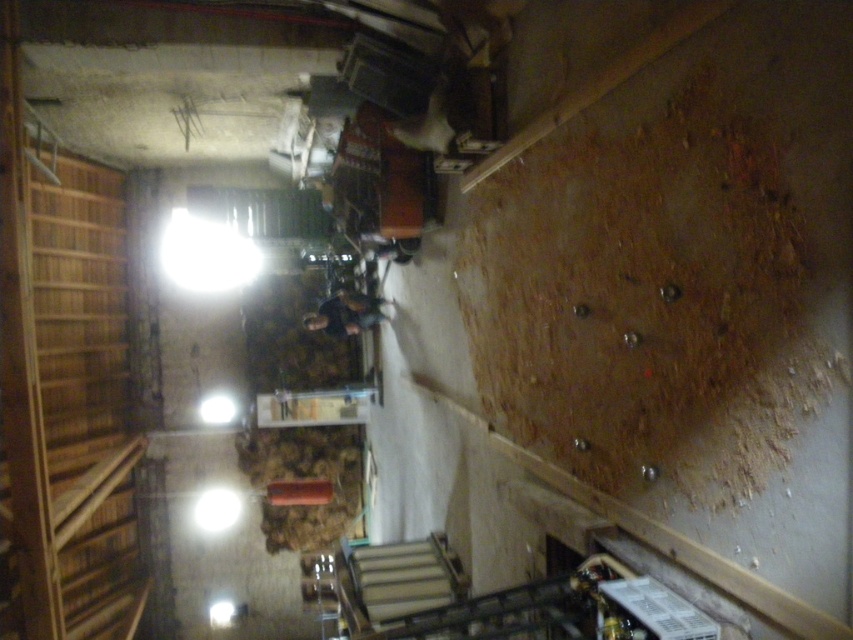
Consider the image. You are standing at the bottom of the wooden stairs at left and want to reach the dark gray fabric jacket at center. Which direction should you move to get closer to the jacket?

You should move away from the wooden stairs at left towards the dark gray fabric jacket at center since the stairs are closer to you than the jacket.

You are standing at the bottom of the wooden stairs at left and want to place the dark gray fabric jacket at center on the floor above. Is the jacket too tall to fit through the staircase?

The wooden stairs at left is taller than the dark gray fabric jacket at center, so the jacket can fit through the staircase.

You are moving a 3.0 meter long ladder from the wooden stairs at left to the dark gray fabric jacket at center. Will the ladder fit through the space between them?

The distance between the wooden stairs at left and dark gray fabric jacket at center is 2.91 meters. Since the ladder is 3.0 meters long, it is slightly longer than the available space. Therefore, the ladder will not fit through the space between them.